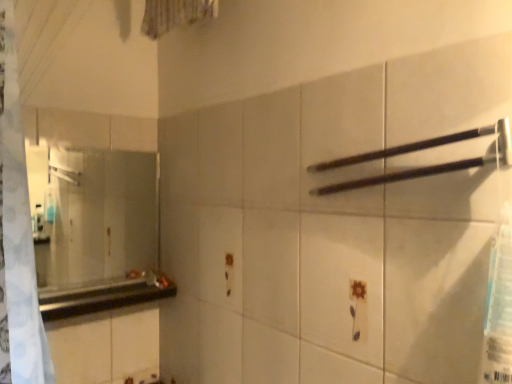
Question: Is black matte towel bar at upper right bigger or smaller than clear glass mirror at left?

Choices:
 (A) big
 (B) small

Answer: (B)

Question: From a real-world perspective, is black matte towel bar at upper right physically located above or below clear glass mirror at left?

Choices:
 (A) above
 (B) below

Answer: (A)

Question: Considering the real-world distances, which object is closest to the black matte towel bar at upper right?

Choices:
 (A) black glossy counter top at left
 (B) clear glass mirror at left

Answer: (A)

Question: Which object is positioned farthest from the black glossy counter top at left?

Choices:
 (A) black matte towel bar at upper right
 (B) clear glass mirror at left

Answer: (A)